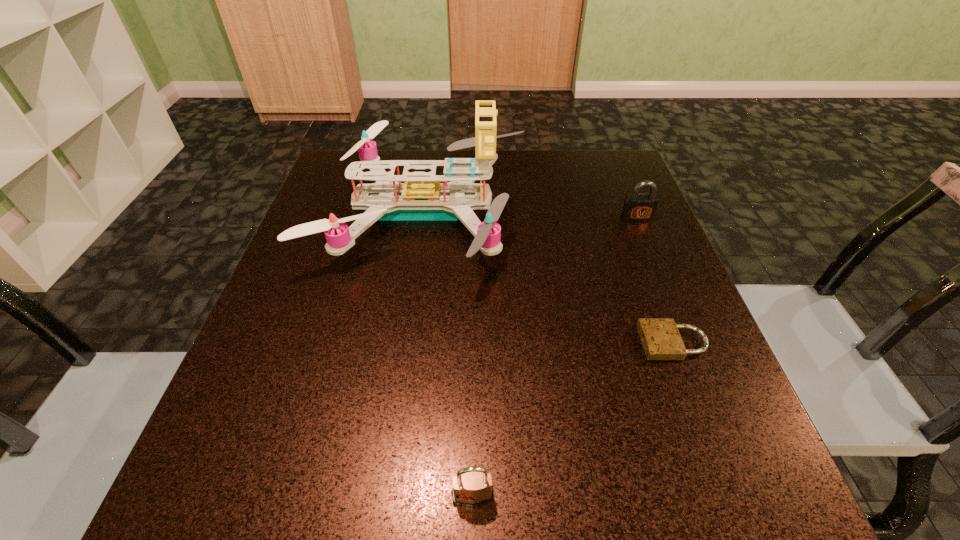
I want to click on free point between the drone and the farthest padlock, so click(x=530, y=215).

Locate an element on the screen. free area in between the second nearest object and the tallest object is located at coordinates [548, 278].

Find the location of a particular element. This screenshot has width=960, height=540. free space between the tallest object and the second nearest padlock is located at coordinates (548, 278).

Where is `unoccupied area between the drone and the farthest padlock`? Image resolution: width=960 pixels, height=540 pixels. unoccupied area between the drone and the farthest padlock is located at coordinates (530, 215).

Choose which object is the third nearest neighbor to the leftmost padlock. Please provide its 2D coordinates. Your answer should be formatted as a tuple, i.e. [(x, y)], where the tuple contains the x and y coordinates of a point satisfying the conditions above.

[(637, 207)]

Locate which object is the closest to the farthest padlock. Please provide its 2D coordinates. Your answer should be formatted as a tuple, i.e. [(x, y)], where the tuple contains the x and y coordinates of a point satisfying the conditions above.

[(420, 198)]

Locate which padlock ranks in proximity to the second nearest object. Please provide its 2D coordinates. Your answer should be formatted as a tuple, i.e. [(x, y)], where the tuple contains the x and y coordinates of a point satisfying the conditions above.

[(637, 207)]

Identify which padlock is the second closest to the tallest object. Please provide its 2D coordinates. Your answer should be formatted as a tuple, i.e. [(x, y)], where the tuple contains the x and y coordinates of a point satisfying the conditions above.

[(637, 207)]

You are a GUI agent. You are given a task and a screenshot of the screen. Output one action in this format:
    pyautogui.click(x=<x>, y=<y>)
    Task: Click on the vacant space that satisfies the following two spatial constraints: 1. on the front-facing side of the drone; 2. on the right side of the leftmost padlock
    
    Given the screenshot: What is the action you would take?
    pyautogui.click(x=381, y=496)

You are a GUI agent. You are given a task and a screenshot of the screen. Output one action in this format:
    pyautogui.click(x=<x>, y=<y>)
    Task: Click on the vacant region that satisfies the following two spatial constraints: 1. on the front-facing side of the nearest object; 2. on the right side of the drone
    
    Given the screenshot: What is the action you would take?
    pyautogui.click(x=381, y=496)